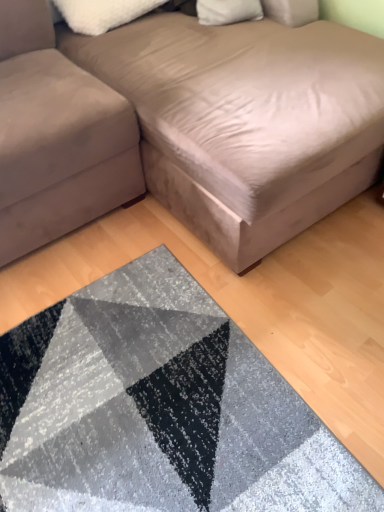
Question: From a real-world perspective, does suede-like beige studio couch at upper center, acting as the second studio couch starting from the left, sit lower than suede-like beige couch at lower left, marked as the 2th studio couch in a right-to-left arrangement?

Choices:
 (A) yes
 (B) no

Answer: (B)

Question: Can you confirm if suede-like beige studio couch at upper center, marked as the first studio couch in a right-to-left arrangement, is shorter than suede-like beige couch at lower left, marked as the 2th studio couch in a right-to-left arrangement?

Choices:
 (A) no
 (B) yes

Answer: (A)

Question: Is suede-like beige studio couch at upper center, marked as the first studio couch in a right-to-left arrangement, further to the viewer compared to suede-like beige couch at lower left, which is the 1th studio couch in left-to-right order?

Choices:
 (A) yes
 (B) no

Answer: (B)

Question: Can you confirm if suede-like beige studio couch at upper center, acting as the second studio couch starting from the left, is thinner than suede-like beige couch at lower left, marked as the 2th studio couch in a right-to-left arrangement?

Choices:
 (A) yes
 (B) no

Answer: (B)

Question: From a real-world perspective, is suede-like beige studio couch at upper center, marked as the first studio couch in a right-to-left arrangement, on top of suede-like beige couch at lower left, marked as the 2th studio couch in a right-to-left arrangement?

Choices:
 (A) no
 (B) yes

Answer: (B)

Question: From the image's perspective, is textured gray rug at lower center located above or below suede-like beige couch at lower left, which is the 1th studio couch in left-to-right order?

Choices:
 (A) below
 (B) above

Answer: (A)

Question: Considering the positions of point (196, 374) and point (24, 6), is point (196, 374) closer or farther from the camera than point (24, 6)?

Choices:
 (A) farther
 (B) closer

Answer: (B)

Question: From their relative heights in the image, would you say textured gray rug at lower center is taller or shorter than suede-like beige couch at lower left, marked as the 2th studio couch in a right-to-left arrangement?

Choices:
 (A) tall
 (B) short

Answer: (B)

Question: Is textured gray rug at lower center in front of or behind suede-like beige couch at lower left, marked as the 2th studio couch in a right-to-left arrangement, in the image?

Choices:
 (A) front
 (B) behind

Answer: (A)

Question: In the image, is suede-like beige couch at lower left, marked as the 2th studio couch in a right-to-left arrangement, positioned in front of or behind white fluffy pillow at upper center?

Choices:
 (A) behind
 (B) front

Answer: (B)

Question: In terms of height, does suede-like beige couch at lower left, marked as the 2th studio couch in a right-to-left arrangement, look taller or shorter compared to white fluffy pillow at upper center?

Choices:
 (A) short
 (B) tall

Answer: (B)

Question: Would you say suede-like beige couch at lower left, which is the 1th studio couch in left-to-right order, is to the left or to the right of white fluffy pillow at upper center in the picture?

Choices:
 (A) right
 (B) left

Answer: (B)

Question: Does point (49, 219) appear closer or farther from the camera than point (96, 8)?

Choices:
 (A) closer
 (B) farther

Answer: (A)

Question: Relative to white fluffy pillow at upper center, is textured gray rug at lower center in front or behind?

Choices:
 (A) front
 (B) behind

Answer: (A)

Question: Considering the positions of point (157, 262) and point (157, 0), is point (157, 262) closer or farther from the camera than point (157, 0)?

Choices:
 (A) farther
 (B) closer

Answer: (B)